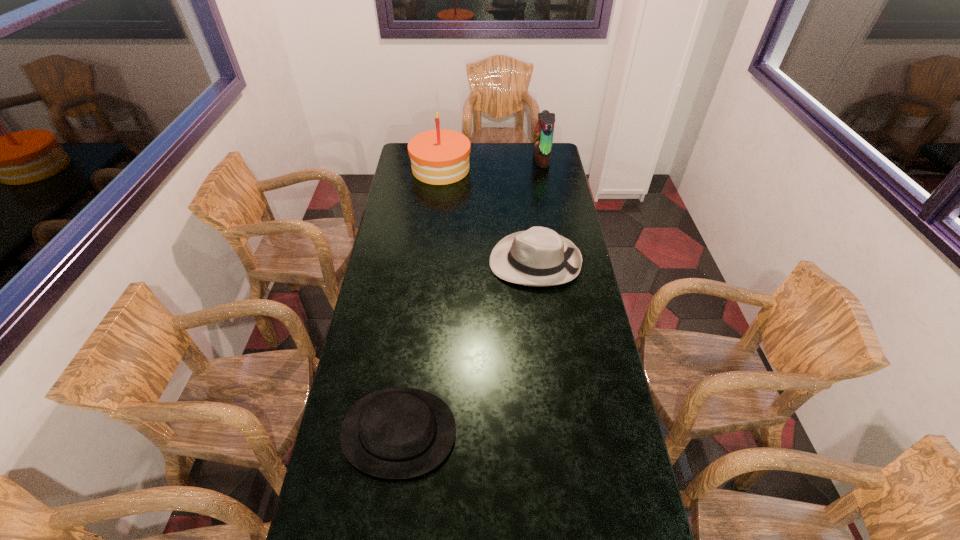
The image size is (960, 540). What are the coordinates of `object that is at the far left corner` in the screenshot? It's located at (438, 157).

Identify the location of object located in the far right corner section of the desktop. This screenshot has height=540, width=960. (544, 130).

This screenshot has height=540, width=960. What are the coordinates of `vacant space at the far edge of the desktop` in the screenshot? It's located at click(514, 154).

In the image, there is a desktop. Identify the location of vacant space at the left edge. (337, 486).

Where is `vacant space at the right edge of the desktop`? This screenshot has height=540, width=960. vacant space at the right edge of the desktop is located at coordinates (588, 478).

Image resolution: width=960 pixels, height=540 pixels. In order to click on free space between the taller fedora and the left fedora in this screenshot , I will do `click(467, 347)`.

Where is `vacant space that is in between the farther fedora and the parrot`? Image resolution: width=960 pixels, height=540 pixels. vacant space that is in between the farther fedora and the parrot is located at coordinates (539, 211).

Select which object is the third closest to the tallest object. Please provide its 2D coordinates. Your answer should be formatted as a tuple, i.e. [(x, y)], where the tuple contains the x and y coordinates of a point satisfying the conditions above.

[(395, 433)]

I want to click on object that stands as the third closest to the shortest object, so click(x=544, y=130).